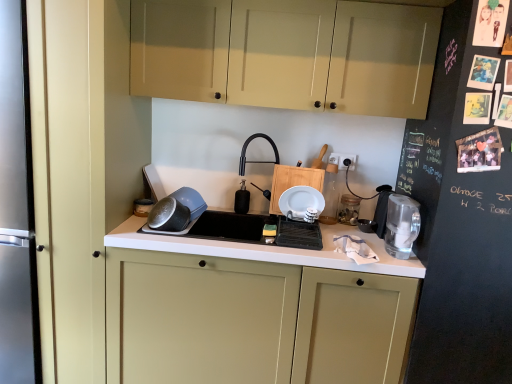
Question: From a real-world perspective, is black matte soap dispenser at center, which is the 3th appliance from right to left, positioned over clear glass water filter at right based on gravity?

Choices:
 (A) no
 (B) yes

Answer: (A)

Question: Can you confirm if black matte soap dispenser at center, marked as the second appliance in a left-to-right arrangement, is taller than clear glass water filter at right?

Choices:
 (A) yes
 (B) no

Answer: (B)

Question: Is black matte soap dispenser at center, which is the 3th appliance from right to left, looking in the opposite direction of clear glass water filter at right?

Choices:
 (A) yes
 (B) no

Answer: (B)

Question: Can you confirm if black matte soap dispenser at center, which is the 3th appliance from right to left, is thinner than clear glass water filter at right?

Choices:
 (A) yes
 (B) no

Answer: (A)

Question: Is the surface of black matte soap dispenser at center, which is the 3th appliance from right to left, in direct contact with clear glass water filter at right?

Choices:
 (A) no
 (B) yes

Answer: (A)

Question: Is white plastic electric outlet at upper right taller or shorter than clear glass water filter at right?

Choices:
 (A) short
 (B) tall

Answer: (A)

Question: From the image's perspective, relative to clear glass water filter at right, is white plastic electric outlet at upper right above or below?

Choices:
 (A) above
 (B) below

Answer: (A)

Question: Is white plastic electric outlet at upper right wider or thinner than clear glass water filter at right?

Choices:
 (A) wide
 (B) thin

Answer: (B)

Question: Does point (352, 168) appear closer or farther from the camera than point (395, 201)?

Choices:
 (A) farther
 (B) closer

Answer: (A)

Question: From the image's perspective, is white plastic electric outlet at upper right positioned above or below black matte faucet at center?

Choices:
 (A) below
 (B) above

Answer: (B)

Question: Based on their positions, is white plastic electric outlet at upper right located to the left or right of black matte faucet at center?

Choices:
 (A) left
 (B) right

Answer: (B)

Question: From their relative heights in the image, would you say white plastic electric outlet at upper right is taller or shorter than black matte faucet at center?

Choices:
 (A) short
 (B) tall

Answer: (A)

Question: From a real-world perspective, is white plastic electric outlet at upper right positioned above or below black matte faucet at center?

Choices:
 (A) below
 (B) above

Answer: (B)

Question: In the image, is translucent glass jar at upper right, placed as the second appliance when sorted from right to left, positioned in front of or behind white plastic electric outlet at upper right?

Choices:
 (A) front
 (B) behind

Answer: (A)

Question: Considering the positions of translucent glass jar at upper right, positioned as the third appliance in left-to-right order, and white plastic electric outlet at upper right in the image, is translucent glass jar at upper right, positioned as the third appliance in left-to-right order, taller or shorter than white plastic electric outlet at upper right?

Choices:
 (A) short
 (B) tall

Answer: (B)